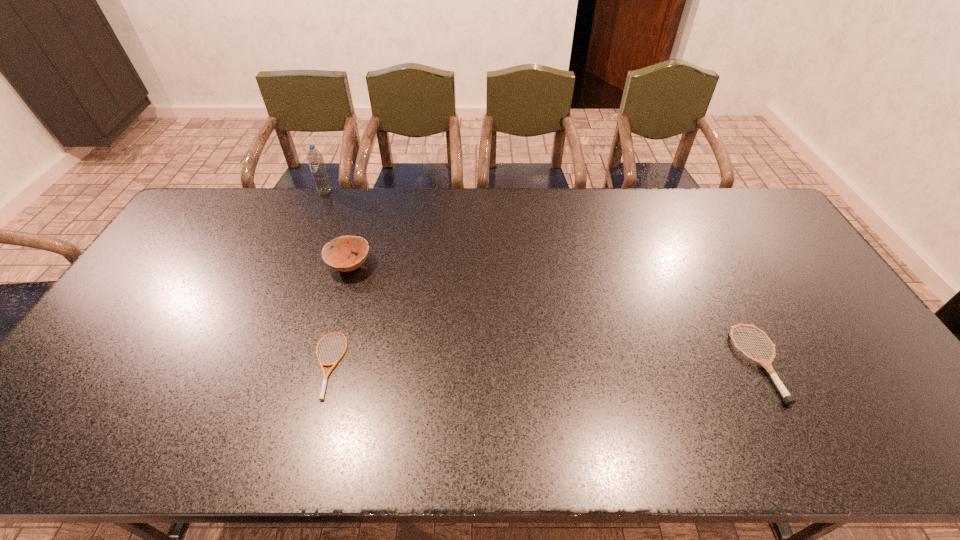
Identify the location of vacant space in between the third shortest object and the left tennis racket. This screenshot has height=540, width=960. (338, 315).

Locate an element on the screen. The height and width of the screenshot is (540, 960). empty location between the farthest object and the third nearest object is located at coordinates (337, 228).

At what (x,y) coordinates should I click in order to perform the action: click on free space between the leftmost object and the shortest object. Please return your answer as a coordinate pair (x, y). The height and width of the screenshot is (540, 960). Looking at the image, I should click on click(x=326, y=279).

Locate an element on the screen. unoccupied position between the water bottle and the shortest object is located at coordinates (326, 279).

The width and height of the screenshot is (960, 540). I want to click on free spot between the right tennis racket and the bowl, so click(x=555, y=314).

Locate an element on the screen. vacant area that lies between the right tennis racket and the shorter tennis racket is located at coordinates (543, 364).

Where is `free space that is in between the third shortest object and the shortest object`? free space that is in between the third shortest object and the shortest object is located at coordinates (338, 315).

Find the location of a particular element. This screenshot has height=540, width=960. free space between the shorter tennis racket and the tallest object is located at coordinates pos(326,279).

The image size is (960, 540). Find the location of `vacant space that is in between the shorter tennis racket and the bowl`. vacant space that is in between the shorter tennis racket and the bowl is located at coordinates (338, 315).

Find the location of a particular element. The width and height of the screenshot is (960, 540). object that is the third closest to the bowl is located at coordinates 788,399.